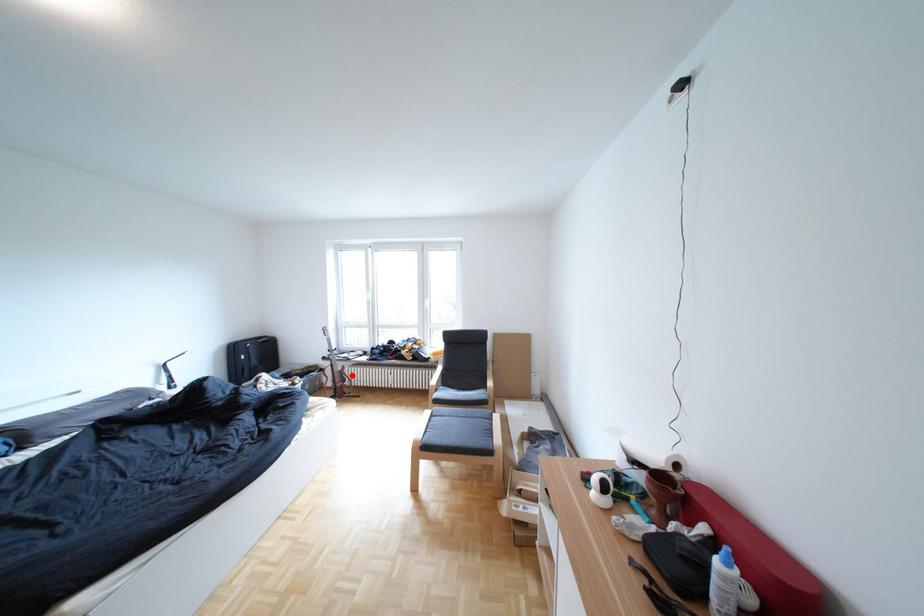
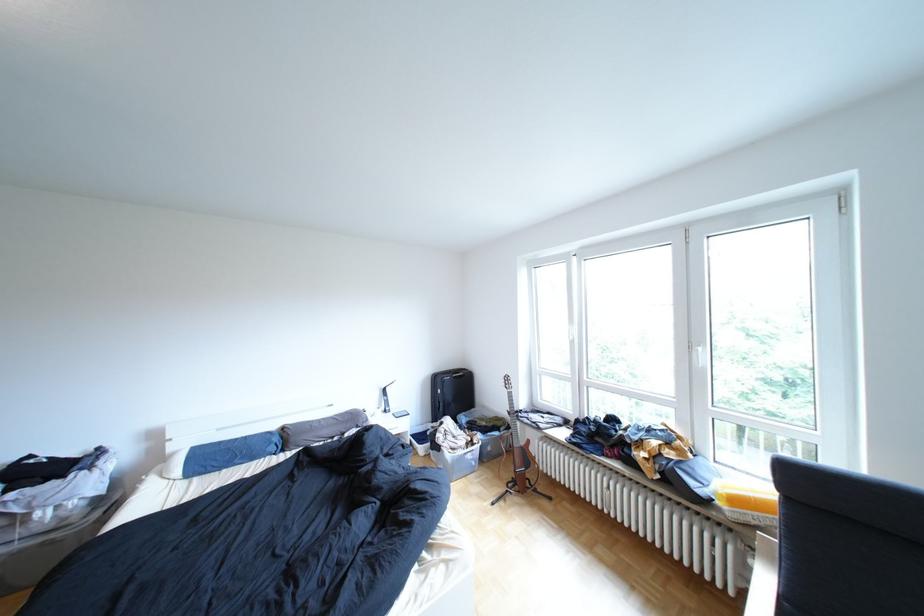
Locate, in the second image, the point that corresponds to the highlighted location in the first image.

(532, 453)